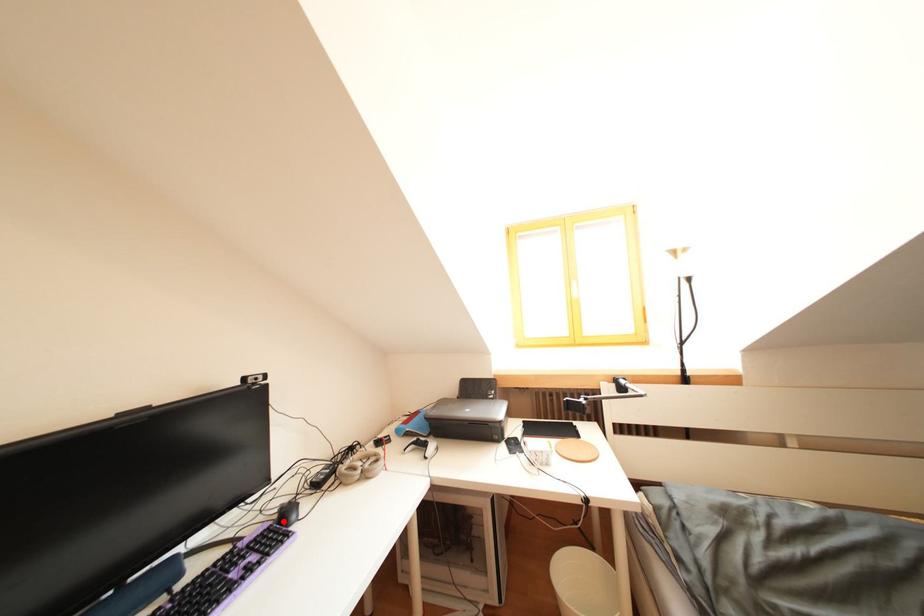
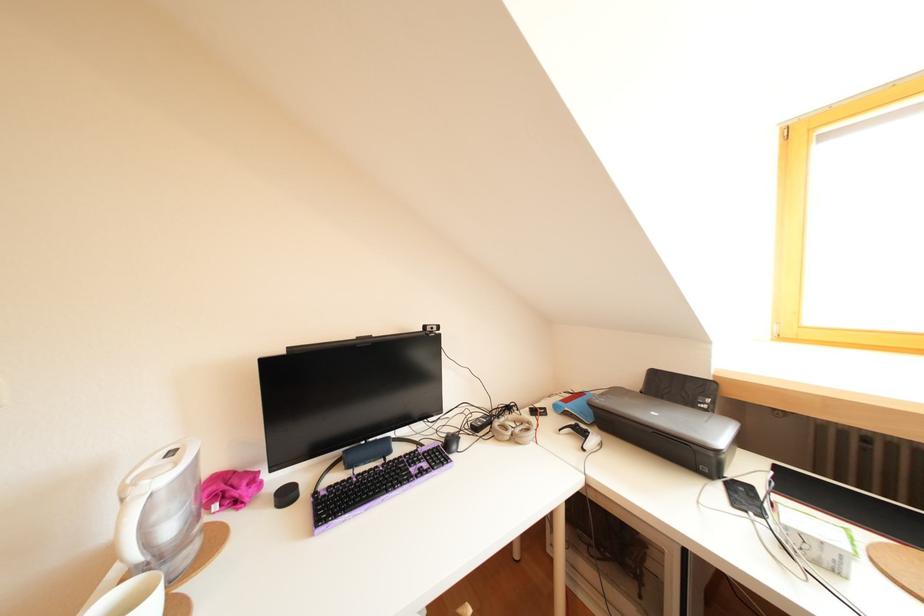
In the second image, find the point that corresponds to the highlighted location in the first image.

(453, 445)